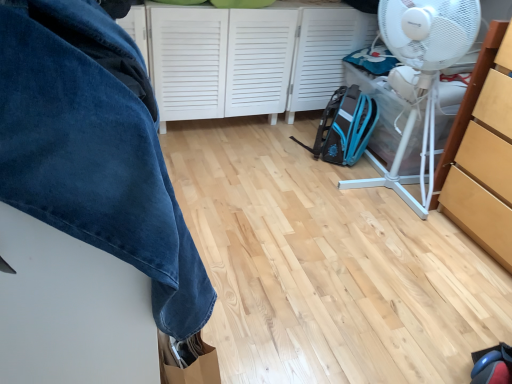
This screenshot has width=512, height=384. Find the location of `vacant space to the left of white plastic mechanical fan at right`. vacant space to the left of white plastic mechanical fan at right is located at coordinates coord(285,174).